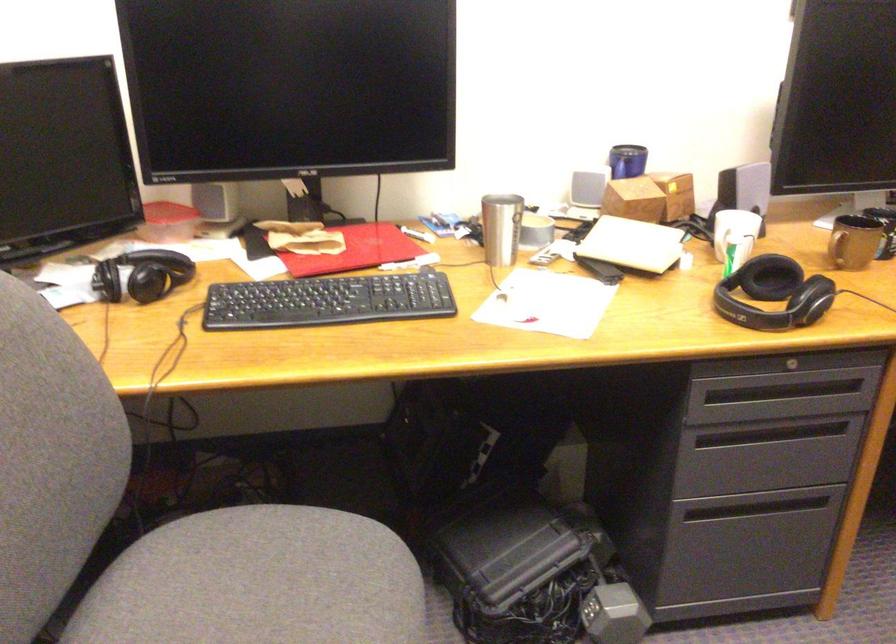
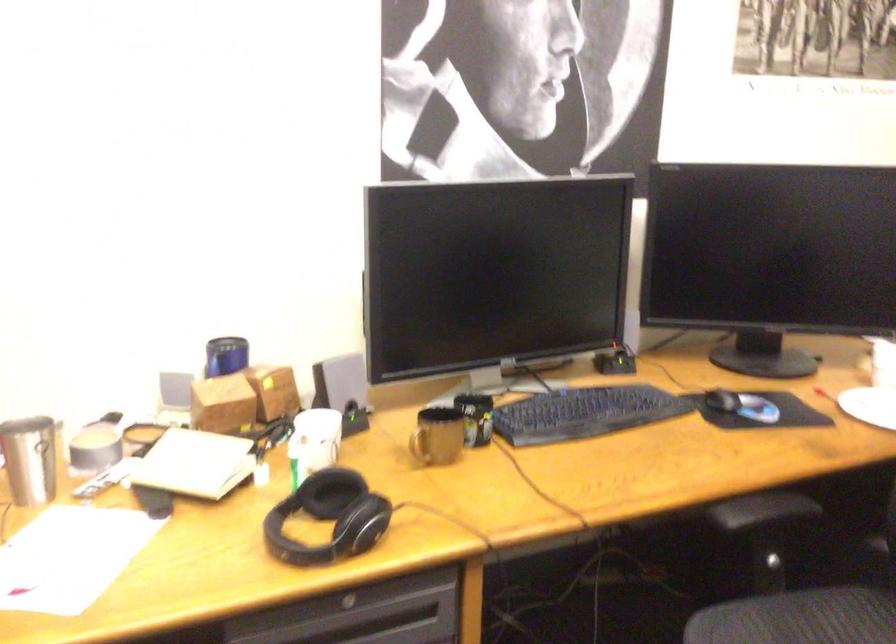
The point at (x=736, y=228) is marked in the first image. Where is the corresponding point in the second image?

(314, 440)